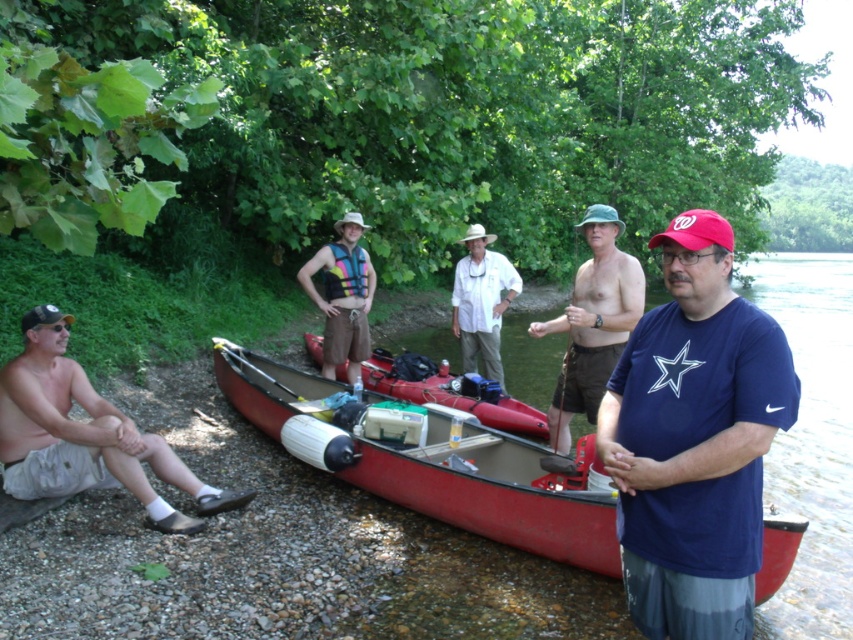
Between point (225, 508) and point (590, 257), which one is positioned behind?

Point (590, 257)

Who is higher up, tan cotton shorts at lower left or green fabric hat at center?

green fabric hat at center is higher up.

Between point (15, 412) and point (604, 326), which one is positioned behind?

Positioned behind is point (604, 326).

Locate an element on the screen. The height and width of the screenshot is (640, 853). tan cotton shorts at lower left is located at coordinates (84, 435).

Can you confirm if blue cotton t-shirt at center is bigger than yellow plastic paddle at center?

No.

Based on the photo, measure the distance between blue cotton t-shirt at center and camera.

The distance of blue cotton t-shirt at center from camera is 7.98 feet.

I want to click on blue cotton t-shirt at center, so click(694, 440).

Is red canoe at center positioned before tan cotton shorts at lower left?

Yes, it is in front of tan cotton shorts at lower left.

Between point (550, 512) and point (1, 392), which one is positioned behind?

Point (1, 392)

Does point (764, 570) lie in front of point (33, 477)?

That is True.

Identify the location of red canoe at center. (486, 490).